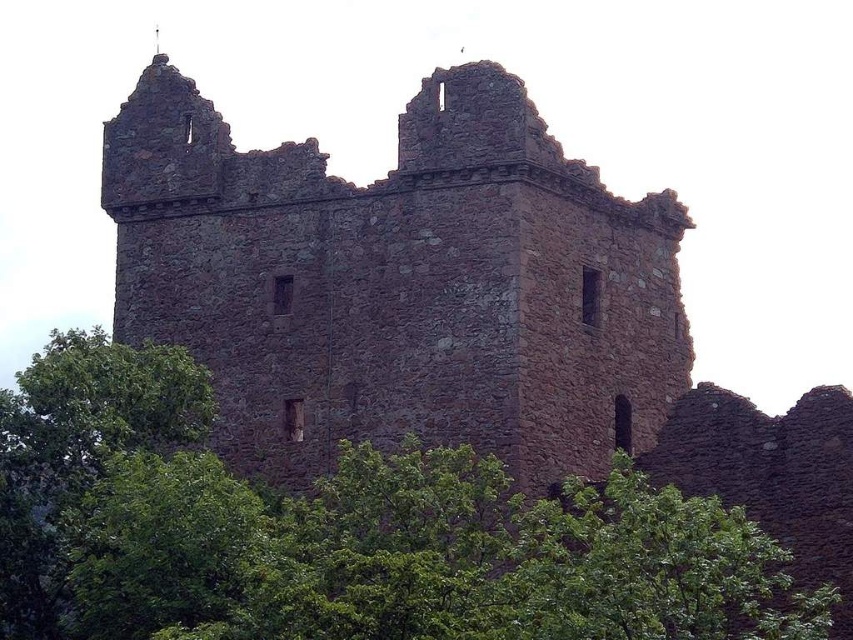
Question: Where is brown stone ruins at center located in relation to green leafy tree at center in the image?

Choices:
 (A) left
 (B) right

Answer: (B)

Question: Which point is closer to the camera?

Choices:
 (A) (241, 292)
 (B) (28, 611)

Answer: (B)

Question: Considering the relative positions of brown stone ruins at center and green leafy tree at center in the image provided, where is brown stone ruins at center located with respect to green leafy tree at center?

Choices:
 (A) left
 (B) right

Answer: (B)

Question: Which point is farther to the camera?

Choices:
 (A) 677,564
 (B) 137,148

Answer: (B)

Question: Can you confirm if brown stone ruins at center is positioned below green leafy tree at center?

Choices:
 (A) no
 (B) yes

Answer: (A)